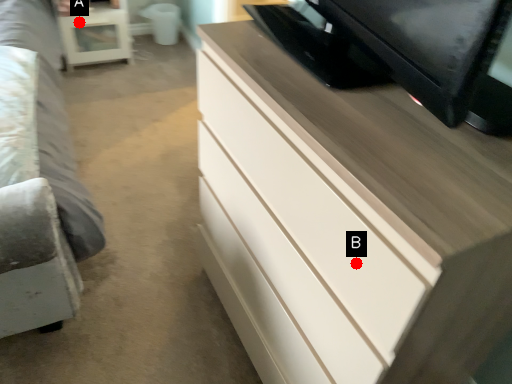
Question: Two points are circled on the image, labeled by A and B beside each circle. Which point appears closest to the camera in this image?

Choices:
 (A) A is closer
 (B) B is closer

Answer: (B)